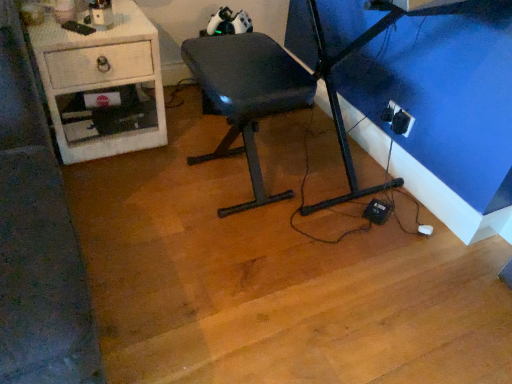
Question: From the image's perspective, does white glossy desk at left appear higher than matte black chair at center?

Choices:
 (A) no
 (B) yes

Answer: (B)

Question: Can we say white glossy desk at left lies outside matte black chair at center?

Choices:
 (A) yes
 (B) no

Answer: (A)

Question: Considering the relative positions of white glossy desk at left and matte black chair at center in the image provided, is white glossy desk at left to the right of matte black chair at center from the viewer's perspective?

Choices:
 (A) yes
 (B) no

Answer: (B)

Question: From the image's perspective, is white glossy desk at left under matte black chair at center?

Choices:
 (A) yes
 (B) no

Answer: (B)

Question: Is white glossy desk at left to the left of matte black chair at center from the viewer's perspective?

Choices:
 (A) yes
 (B) no

Answer: (A)

Question: Considering the relative sizes of white glossy desk at left and matte black chair at center in the image provided, is white glossy desk at left shorter than matte black chair at center?

Choices:
 (A) yes
 (B) no

Answer: (A)

Question: Can you confirm if matte black chair at center is taller than black plastic outlet at lower right?

Choices:
 (A) no
 (B) yes

Answer: (B)

Question: Does matte black chair at center have a lesser width compared to black plastic outlet at lower right?

Choices:
 (A) yes
 (B) no

Answer: (B)

Question: Is matte black chair at center turned away from black plastic outlet at lower right?

Choices:
 (A) yes
 (B) no

Answer: (A)

Question: Is matte black chair at center at the left side of black plastic outlet at lower right?

Choices:
 (A) no
 (B) yes

Answer: (B)

Question: Does matte black chair at center come in front of black plastic outlet at lower right?

Choices:
 (A) no
 (B) yes

Answer: (B)

Question: Is matte black chair at center bigger than black plastic outlet at lower right?

Choices:
 (A) no
 (B) yes

Answer: (B)

Question: Is matte black chair at center surrounding white glossy desk at left?

Choices:
 (A) no
 (B) yes

Answer: (A)